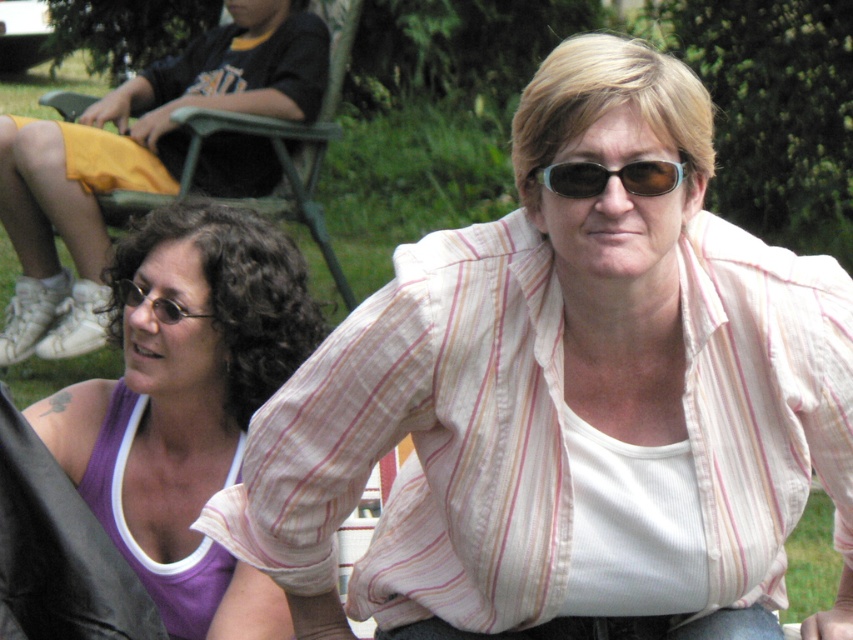
You are a photographer setting up a shot of the two women in the park. You notice the sunglasses at center and the matte black glasses at lower left. Which of these two items should you focus on if you want to capture the one that is positioned higher in the frame?

The sunglasses at center is above the matte black glasses at lower left, so you should focus on the sunglasses at center to capture the higher positioned item.

You are standing in a park and see two points marked in the image. The first point is at coordinate point (683, 176) and the second is at point (126, 285). Which point is closer to you?

Point (683, 176) is closer to the viewer than point (126, 285).

You are a photographer trying to capture a clear shot of the sunglasses at center and the purple fabric tank top at left. Which object is closer to the camera?

The sunglasses at center is behind the purple fabric tank top at left, so the purple fabric tank top at left is closer to the camera.